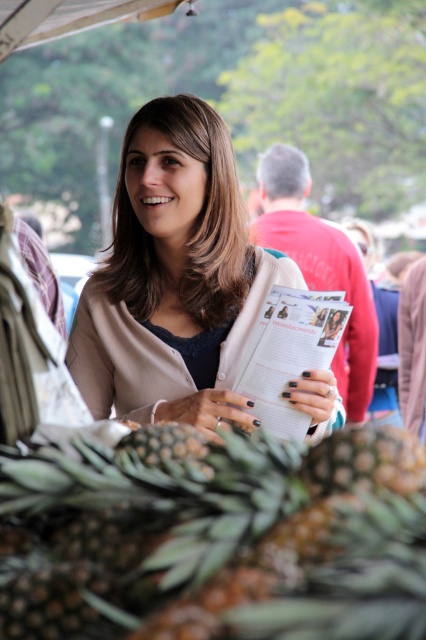
Question: Which is nearer to the brown rough pineapple at lower center?

Choices:
 (A) light beige sweater at center
 (B) white paper magazine at center
 (C) white paper at center

Answer: (B)

Question: Does light beige sweater at center have a larger size compared to white paper magazine at center?

Choices:
 (A) no
 (B) yes

Answer: (B)

Question: Which point is closer to the camera?

Choices:
 (A) click(x=152, y=340)
 (B) click(x=276, y=397)
 (C) click(x=288, y=228)
 (D) click(x=126, y=508)

Answer: (D)

Question: Can you confirm if brown rough pineapple at lower center is positioned below white paper at center?

Choices:
 (A) yes
 (B) no

Answer: (A)

Question: Which of the following is the closest to the observer?

Choices:
 (A) (313, 257)
 (B) (135, 609)

Answer: (B)

Question: Is light beige sweater at center to the left of white paper at center from the viewer's perspective?

Choices:
 (A) no
 (B) yes

Answer: (B)